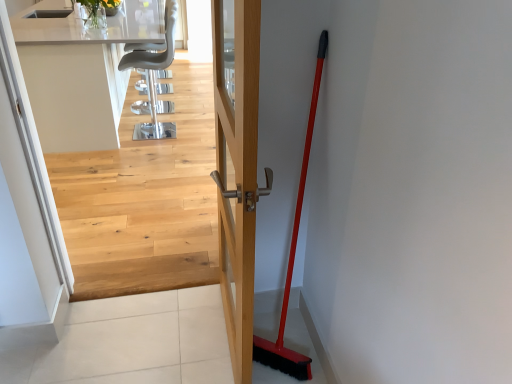
Question: Considering the relative positions of red plastic shovel at right and white glossy countertop at upper center in the image provided, is red plastic shovel at right in front of white glossy countertop at upper center?

Choices:
 (A) yes
 (B) no

Answer: (A)

Question: Considering the relative sizes of red plastic shovel at right and white glossy countertop at upper center in the image provided, is red plastic shovel at right smaller than white glossy countertop at upper center?

Choices:
 (A) no
 (B) yes

Answer: (B)

Question: From a real-world perspective, does red plastic shovel at right sit lower than white glossy countertop at upper center?

Choices:
 (A) yes
 (B) no

Answer: (B)

Question: Can you confirm if red plastic shovel at right is thinner than white glossy countertop at upper center?

Choices:
 (A) no
 (B) yes

Answer: (B)

Question: Does red plastic shovel at right contain white glossy countertop at upper center?

Choices:
 (A) yes
 (B) no

Answer: (B)

Question: Is red plastic shovel at right facing towards white glossy countertop at upper center?

Choices:
 (A) no
 (B) yes

Answer: (A)

Question: Can you confirm if white glossy countertop at upper center is shorter than metallic gray chair at upper center?

Choices:
 (A) no
 (B) yes

Answer: (B)

Question: Would you say white glossy countertop at upper center contains metallic gray chair at upper center?

Choices:
 (A) no
 (B) yes

Answer: (B)

Question: Is white glossy countertop at upper center further to camera compared to metallic gray chair at upper center?

Choices:
 (A) yes
 (B) no

Answer: (B)

Question: From the image's perspective, is white glossy countertop at upper center above metallic gray chair at upper center?

Choices:
 (A) no
 (B) yes

Answer: (B)

Question: Can you confirm if white glossy countertop at upper center is taller than metallic gray chair at upper center?

Choices:
 (A) no
 (B) yes

Answer: (A)

Question: Is white glossy countertop at upper center outside metallic gray chair at upper center?

Choices:
 (A) no
 (B) yes

Answer: (B)

Question: Is light wood floor at upper center a part of metallic gray chair at upper center?

Choices:
 (A) no
 (B) yes

Answer: (A)